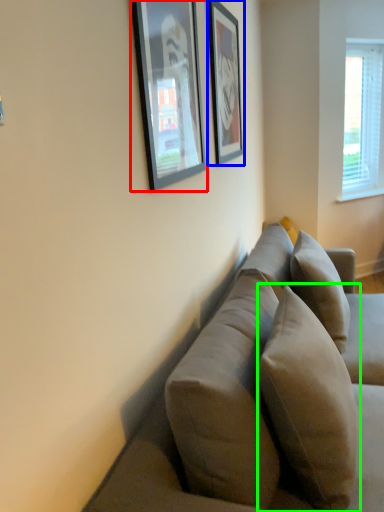
Question: Considering the real-world distances, which object is closest to picture frame (highlighted by a red box)? picture frame (highlighted by a blue box) or pillow (highlighted by a green box).

Choices:
 (A) picture frame
 (B) pillow

Answer: (A)